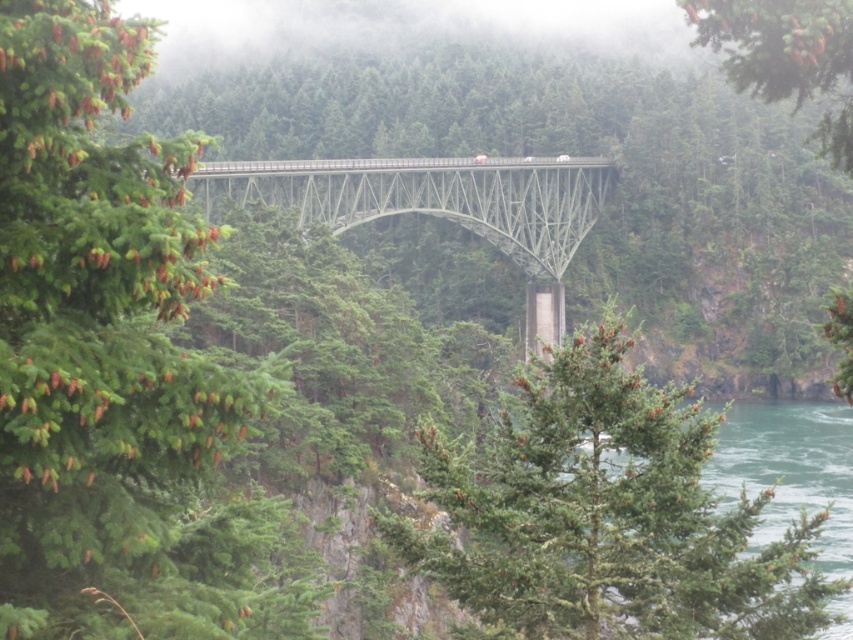
Based on the photo, is green matte tree at center positioned before green matte tree at upper center?

Yes.

Does green matte tree at center have a lesser width compared to green matte tree at upper center?

Yes.

Between point (747, 624) and point (842, 8), which one is positioned in front?

Point (747, 624) is in front.

Locate an element on the screen. The image size is (853, 640). green matte tree at center is located at coordinates (606, 515).

Is green matte tree at upper left wider than green matte tree at upper center?

No.

Is point (173, 209) closer to viewer compared to point (782, 88)?

Yes, it is.

I want to click on green matte tree at upper left, so click(114, 362).

Can you confirm if green matte tree at upper left is smaller than green water at lower right?

Yes, green matte tree at upper left is smaller than green water at lower right.

How distant is green matte tree at upper left from green water at lower right?

The distance of green matte tree at upper left from green water at lower right is 88.50 feet.

I want to click on green matte tree at upper left, so tap(114, 362).